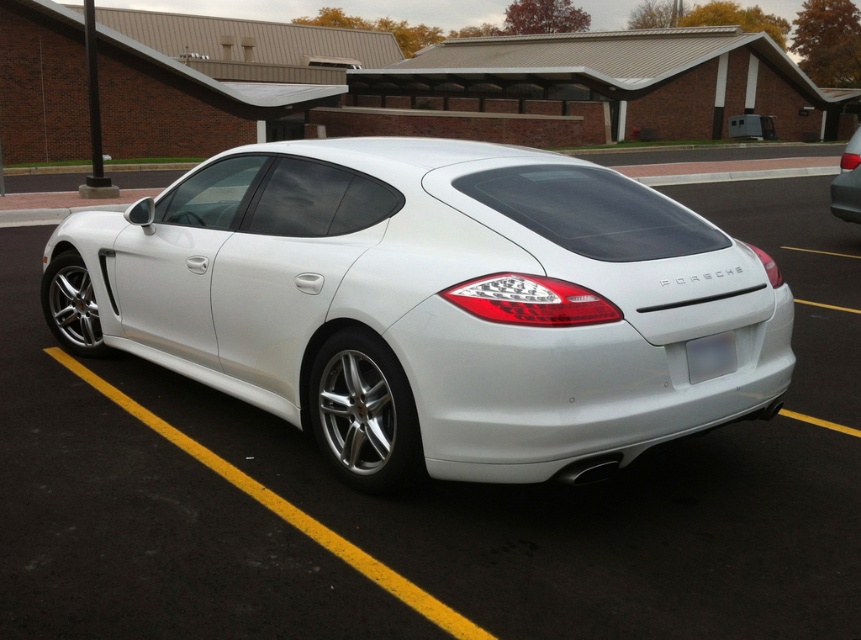
You are standing in a parking lot and see a white Porsche Panamera parked at center. There is a point marked at coordinates (430, 305). According to the image, where is this point located?

The point marked at coordinates (430, 305) is on the white metallic car at center.

You are a parking attendant and need to guide a customer to their car. They mention they have a white metallic car at center and a white glossy car at right. Which car is closer to the parking lot entrance located at the left side of the image?

The white metallic car at center is closer to the parking lot entrance located at the left side of the image since it is positioned to the left of the white glossy car at right.

You are a parking attendant who needs to verify the license plate of the white metallic car at center. Since you are standing at the front of the car, which direction should you walk to see the white plastic license plate at rear?

Since the white metallic car at center has a larger size compared to white plastic license plate at rear, you should walk towards the rear of the car to see the white plastic license plate at rear.